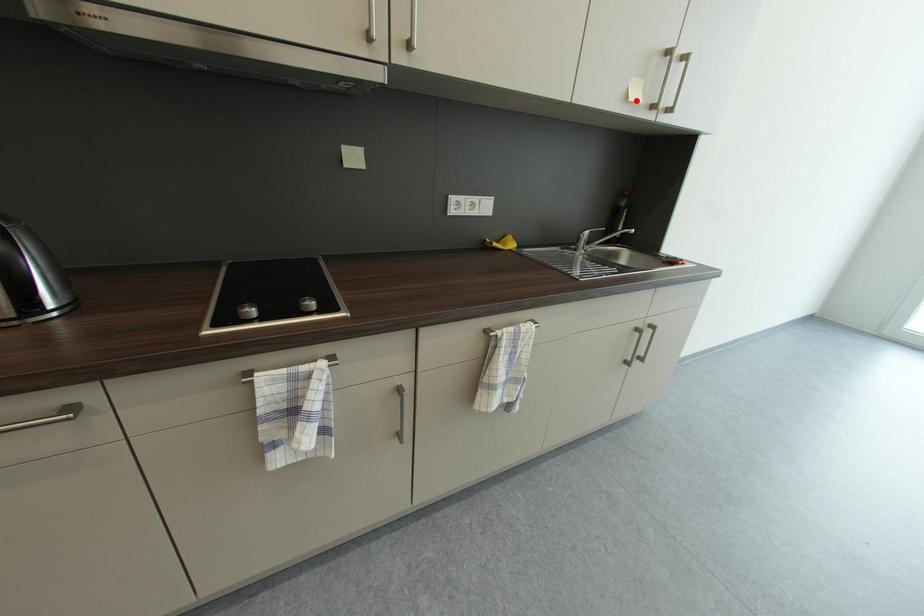
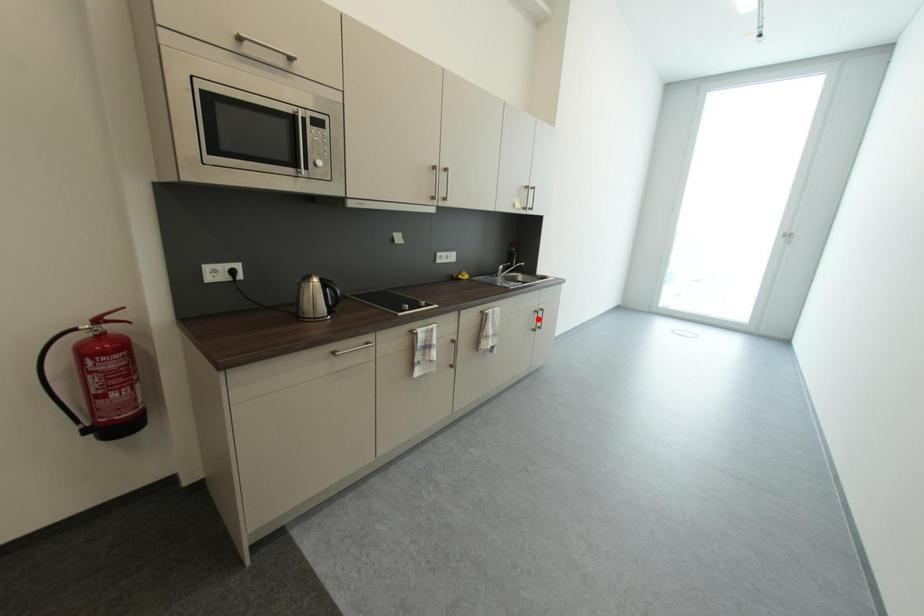
I am providing you with two images of the same scene from different viewpoints. A red point is marked on the first image and another point is marked on the second image. Is the red point in image1 aligned with the point shown in image2?

No